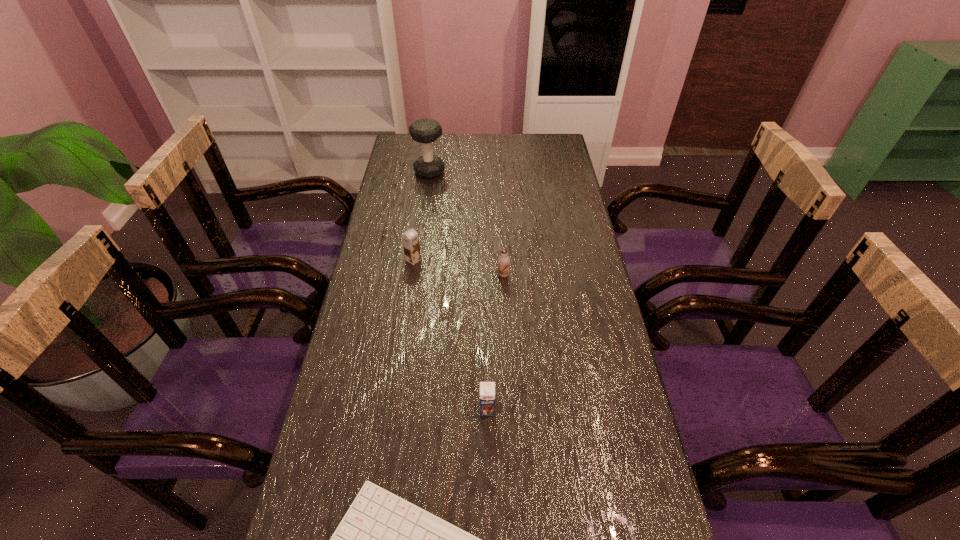
This screenshot has width=960, height=540. Identify the location of free space that is in between the rightmost chocolate milk and the farthest chocolate milk. (458, 267).

The height and width of the screenshot is (540, 960). I want to click on vacant space in between the dumbbell and the fourth farthest object, so click(x=458, y=291).

Where is `free space that is in between the second farthest object and the rightmost chocolate milk`? The image size is (960, 540). free space that is in between the second farthest object and the rightmost chocolate milk is located at coordinates (458, 267).

Image resolution: width=960 pixels, height=540 pixels. In order to click on free space between the tallest object and the rightmost chocolate milk in this screenshot , I will do tap(467, 224).

Identify which object is the closest to the fourth farthest object. Please provide its 2D coordinates. Your answer should be formatted as a tuple, i.e. [(x, y)], where the tuple contains the x and y coordinates of a point satisfying the conditions above.

[(383, 539)]

Select which object is the fourth closest to the computer keyboard. Please provide its 2D coordinates. Your answer should be formatted as a tuple, i.e. [(x, y)], where the tuple contains the x and y coordinates of a point satisfying the conditions above.

[(425, 131)]

The width and height of the screenshot is (960, 540). What are the coordinates of `chocolate milk that is the second closest to the computer keyboard` in the screenshot? It's located at (503, 261).

Identify which chocolate milk is located as the third nearest to the nearest object. Please provide its 2D coordinates. Your answer should be formatted as a tuple, i.e. [(x, y)], where the tuple contains the x and y coordinates of a point satisfying the conditions above.

[(410, 239)]

At what (x,y) coordinates should I click in order to perform the action: click on vacant space that satisfies the following two spatial constraints: 1. on the front side of the second farthest chocolate milk; 2. on the right side of the farthest chocolate milk. Please return your answer as a coordinate pair (x, y). Image resolution: width=960 pixels, height=540 pixels. Looking at the image, I should click on click(411, 275).

Locate an element on the screen. The width and height of the screenshot is (960, 540). free space that satisfies the following two spatial constraints: 1. on the front side of the leftmost chocolate milk; 2. on the right side of the rightmost chocolate milk is located at coordinates (411, 275).